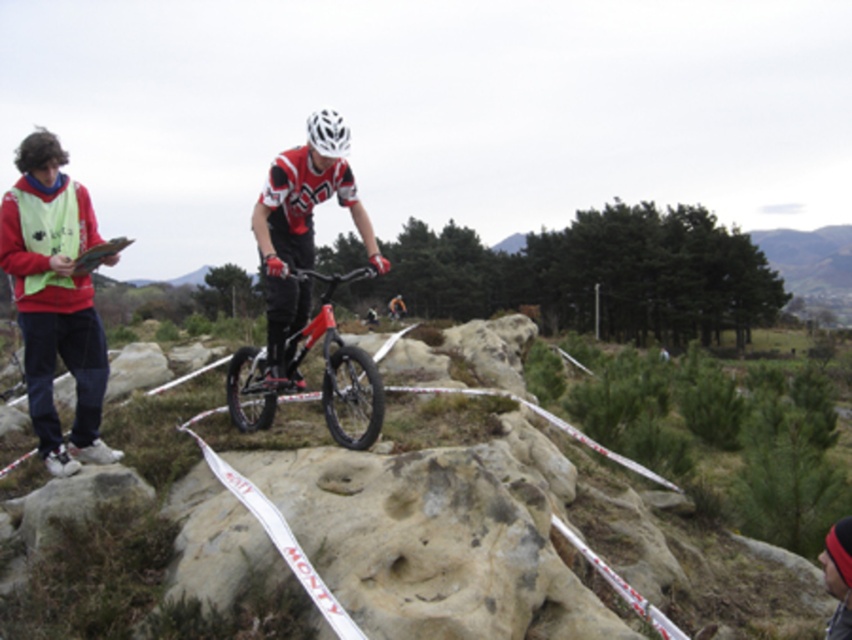
Question: Does matte red bicycle at center appear on the left side of white matte bicycle helmet at center?

Choices:
 (A) yes
 (B) no

Answer: (B)

Question: Which object is closer to the camera taking this photo?

Choices:
 (A) matte black bicycle at center
 (B) matte red bicycle at center
 (C) white matte bicycle helmet at center

Answer: (B)

Question: Which of the following is the closest to the observer?

Choices:
 (A) (45, 314)
 (B) (249, 374)

Answer: (A)

Question: Is matte black bicycle at center further to camera compared to white matte bicycle helmet at center?

Choices:
 (A) no
 (B) yes

Answer: (A)

Question: Does matte black bicycle at center appear on the right side of matte red bicycle at center?

Choices:
 (A) no
 (B) yes

Answer: (A)

Question: Which object is the closest to the matte black bicycle at center?

Choices:
 (A) matte red bicycle at center
 (B) white matte bicycle helmet at center

Answer: (A)